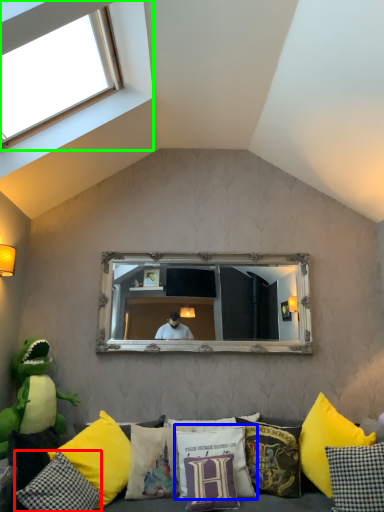
Question: Which is farther away from pillow (highlighted by a red box)? pillow (highlighted by a blue box) or window (highlighted by a green box)?

Choices:
 (A) pillow
 (B) window

Answer: (B)